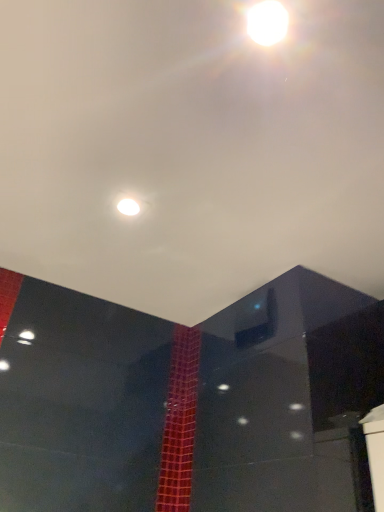
Where is `white glossy light at upper center`? white glossy light at upper center is located at coordinates (267, 22).

Describe the element at coordinates (267, 22) in the screenshot. This screenshot has height=512, width=384. I see `white glossy light at upper center` at that location.

This screenshot has height=512, width=384. I want to click on white glossy light at upper center, so click(x=128, y=207).

What do you see at coordinates (128, 207) in the screenshot? I see `white glossy light at upper center` at bounding box center [128, 207].

The image size is (384, 512). What are the coordinates of `white glossy light at upper center` in the screenshot? It's located at (267, 22).

Is white glossy light at upper center at the left side of white glossy light at upper center?

Incorrect, white glossy light at upper center is not on the left side of white glossy light at upper center.

Which object is more forward, white glossy light at upper center or white glossy light at upper center?

Positioned in front is white glossy light at upper center.

Is point (269, 25) closer to viewer compared to point (124, 201)?

Yes, it is.

From the image's perspective, is white glossy light at upper center under white glossy light at upper center?

Incorrect, from the image's perspective, white glossy light at upper center is higher than white glossy light at upper center.

From a real-world perspective, who is located lower, white glossy light at upper center or white glossy light at upper center?

white glossy light at upper center, from a real-world perspective.

Based on the photo, in terms of width, does white glossy light at upper center look wider or thinner when compared to white glossy light at upper center?

Considering their sizes, white glossy light at upper center looks slimmer than white glossy light at upper center.

Which of these two, white glossy light at upper center or white glossy light at upper center, stands shorter?

white glossy light at upper center.

Between white glossy light at upper center and white glossy light at upper center, which one has smaller size?

white glossy light at upper center is smaller.

Is white glossy light at upper center not inside white glossy light at upper center?

Yes, white glossy light at upper center is not within white glossy light at upper center.

Is there a large distance between white glossy light at upper center and white glossy light at upper center?

No, there isn't a large distance between white glossy light at upper center and white glossy light at upper center.

Could you tell me if white glossy light at upper center is facing white glossy light at upper center?

Yes, white glossy light at upper center is turned towards white glossy light at upper center.

Can you tell me how much white glossy light at upper center and white glossy light at upper center differ in facing direction?

The angular difference between white glossy light at upper center and white glossy light at upper center is 178 degrees.

How far apart are white glossy light at upper center and white glossy light at upper center?

They are 21.34 inches apart.

Identify the location of lamp above the white glossy light at upper center (from the image's perspective). The height and width of the screenshot is (512, 384). (267, 22).

Considering the relative positions of white glossy light at upper center and white glossy light at upper center in the image provided, is white glossy light at upper center to the left of white glossy light at upper center from the viewer's perspective?

Indeed, white glossy light at upper center is positioned on the left side of white glossy light at upper center.

Which object is more forward, white glossy light at upper center or white glossy light at upper center?

white glossy light at upper center.

Considering the positions of point (128, 198) and point (277, 33), is point (128, 198) closer or farther from the camera than point (277, 33)?

Clearly, point (128, 198) is more distant from the camera than point (277, 33).

From the image's perspective, who appears lower, white glossy light at upper center or white glossy light at upper center?

white glossy light at upper center is shown below in the image.

From a real-world perspective, which object rests below the other?

white glossy light at upper center, from a real-world perspective.

Between white glossy light at upper center and white glossy light at upper center, which one has smaller width?

white glossy light at upper center is thinner.

Considering the sizes of objects white glossy light at upper center and white glossy light at upper center in the image provided, who is shorter, white glossy light at upper center or white glossy light at upper center?

With less height is white glossy light at upper center.

In terms of size, does white glossy light at upper center appear bigger or smaller than white glossy light at upper center?

white glossy light at upper center is smaller than white glossy light at upper center.

Is white glossy light at upper center outside of white glossy light at upper center?

Indeed, white glossy light at upper center is completely outside white glossy light at upper center.

Is there a large distance between white glossy light at upper center and white glossy light at upper center?

white glossy light at upper center is near white glossy light at upper center, not far away.

Is white glossy light at upper center looking in the opposite direction of white glossy light at upper center?

No, white glossy light at upper center is not at the back of white glossy light at upper center.

Can you tell me how much white glossy light at upper center and white glossy light at upper center differ in facing direction?

The angle between the facing direction of white glossy light at upper center and the facing direction of white glossy light at upper center is 178 degrees.

Locate an element on the screen. light behind the white glossy light at upper center is located at coordinates (128, 207).

Identify the location of light located behind the white glossy light at upper center. The image size is (384, 512). (128, 207).

Find the location of `lamp located on the right of white glossy light at upper center`. lamp located on the right of white glossy light at upper center is located at coordinates (267, 22).